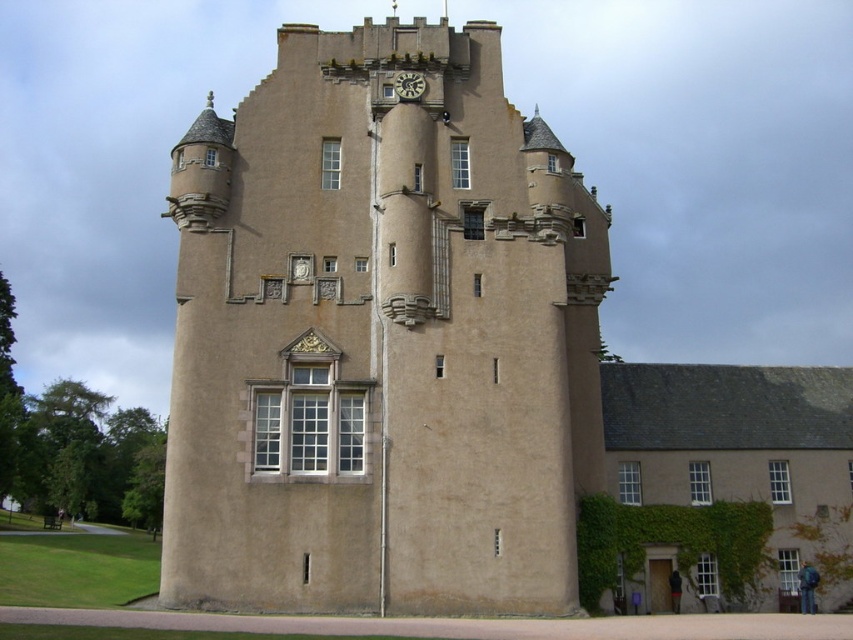
You are a maintenance worker needing to reach both the beige stone tower at center and the matte stone clock at upper center. The ladder you have can only extend to 10 meters. Can you use the same ladder to access both objects without moving it?

The distance between the beige stone tower at center and the matte stone clock at upper center is 9.60 meters, which is within the ladder extension limit of 10 meters. Therefore, the same ladder can be used to access both objects without moving it.

You are an architect examining the historic stone building. You notice the beige stone tower at center and the matte stone clock at upper center. Which of these two elements is bigger in size?

The beige stone tower at center is larger in size compared to the matte stone clock at upper center.

You are an architect examining the historic stone building. You notice the beige stone tower at center and the matte stone clock at upper center. Which object is located to the left of the other?

The beige stone tower at center is positioned on the left side of matte stone clock at upper center.